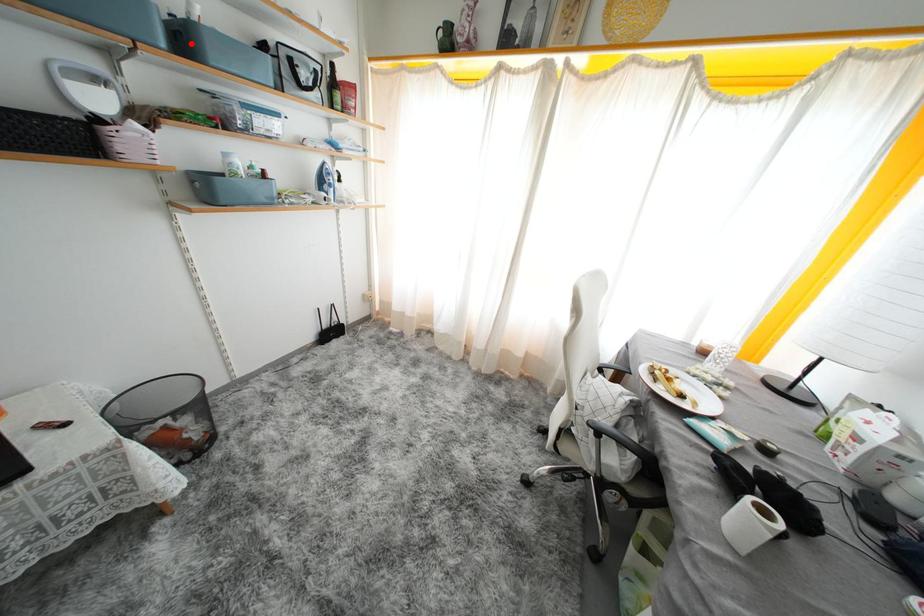
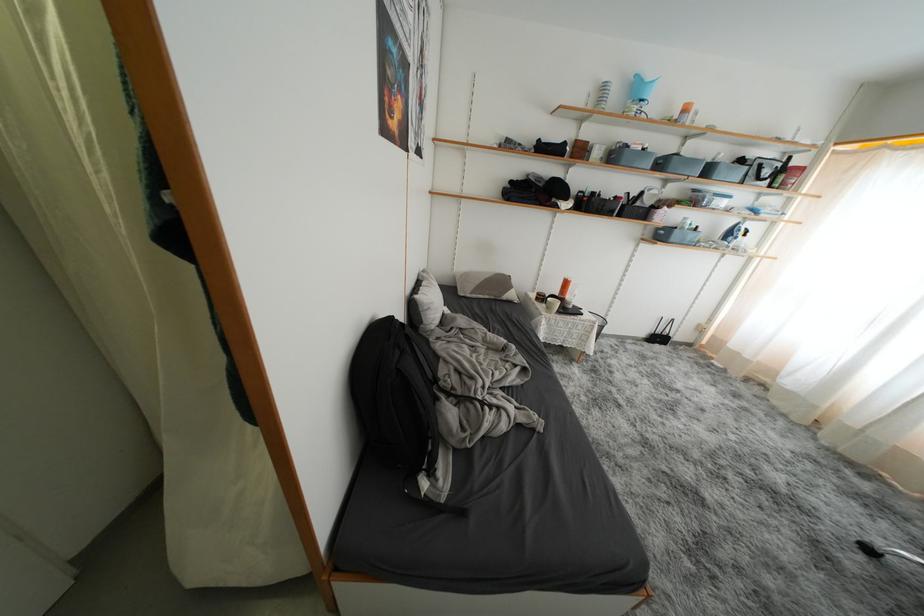
The point at the highlighted location is marked in the first image. Where is the corresponding point in the second image?

(714, 175)